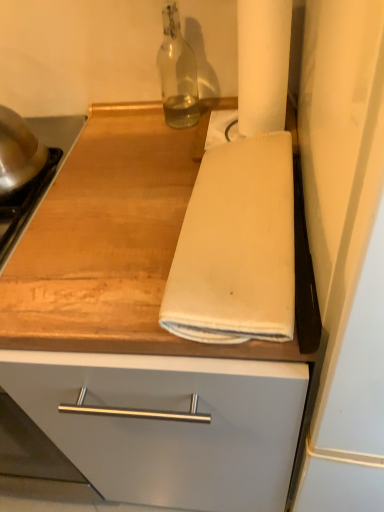
Question: Is white cotton towel at center bigger than white matte paper towel at upper right?

Choices:
 (A) no
 (B) yes

Answer: (B)

Question: From the image's perspective, is white cotton towel at center beneath white matte paper towel at upper right?

Choices:
 (A) no
 (B) yes

Answer: (B)

Question: Considering the relative sizes of white cotton towel at center and white matte paper towel at upper right in the image provided, is white cotton towel at center smaller than white matte paper towel at upper right?

Choices:
 (A) no
 (B) yes

Answer: (A)

Question: Is white matte paper towel at upper right at the back of white cotton towel at center?

Choices:
 (A) yes
 (B) no

Answer: (B)

Question: Is white cotton towel at center completely or partially outside of white matte paper towel at upper right?

Choices:
 (A) no
 (B) yes

Answer: (B)

Question: From their relative heights in the image, would you say white matte paper towel at upper right is taller or shorter than white cotton towel at center?

Choices:
 (A) short
 (B) tall

Answer: (B)

Question: Looking at the image, does white matte paper towel at upper right seem bigger or smaller compared to white cotton towel at center?

Choices:
 (A) small
 (B) big

Answer: (A)

Question: Would you say white matte paper towel at upper right is inside or outside white cotton towel at center?

Choices:
 (A) inside
 (B) outside

Answer: (B)

Question: From a real-world perspective, relative to white cotton towel at center, is white matte paper towel at upper right vertically above or below?

Choices:
 (A) below
 (B) above

Answer: (B)

Question: Is transparent glass bottle at upper center wider or thinner than wooden at center?

Choices:
 (A) thin
 (B) wide

Answer: (A)

Question: Choose the correct answer: Is transparent glass bottle at upper center inside wooden at center or outside it?

Choices:
 (A) outside
 (B) inside

Answer: (A)

Question: From the image's perspective, is transparent glass bottle at upper center above or below wooden at center?

Choices:
 (A) below
 (B) above

Answer: (B)

Question: Would you say transparent glass bottle at upper center is to the left or to the right of wooden at center in the picture?

Choices:
 (A) left
 (B) right

Answer: (A)

Question: Considering their positions, is wooden at center located in front of or behind white cotton towel at center?

Choices:
 (A) behind
 (B) front

Answer: (B)

Question: In terms of width, does wooden at center look wider or thinner when compared to white cotton towel at center?

Choices:
 (A) thin
 (B) wide

Answer: (B)